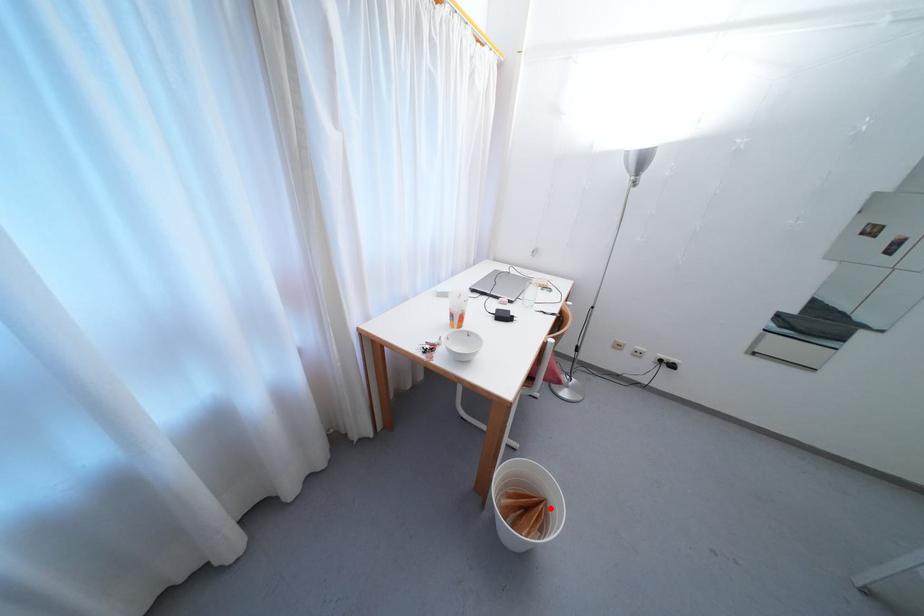
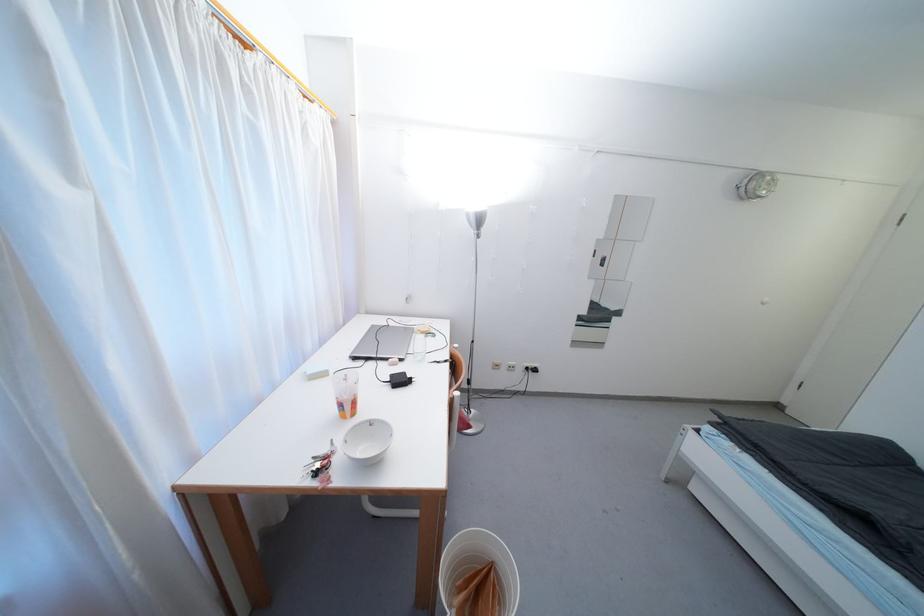
Find the pixel in the second image that matches the highlighted location in the first image.

(499, 572)